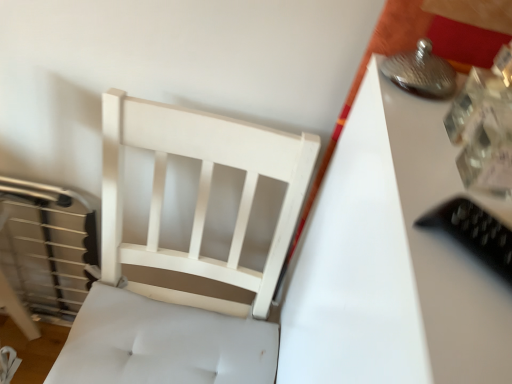
Question: Is white wood chair at left thinner than black plastic remote at right?

Choices:
 (A) yes
 (B) no

Answer: (B)

Question: Is white wood chair at left with black plastic remote at right?

Choices:
 (A) no
 (B) yes

Answer: (A)

Question: Is white wood chair at left positioned beyond the bounds of black plastic remote at right?

Choices:
 (A) no
 (B) yes

Answer: (B)

Question: Can you confirm if white wood chair at left is wider than black plastic remote at right?

Choices:
 (A) no
 (B) yes

Answer: (B)

Question: Considering the relative positions of white wood chair at left and black plastic remote at right in the image provided, is white wood chair at left to the right of black plastic remote at right from the viewer's perspective?

Choices:
 (A) yes
 (B) no

Answer: (B)

Question: From the image's perspective, is black plastic remote at right located above or below white glossy table at upper right?

Choices:
 (A) above
 (B) below

Answer: (A)

Question: Is black plastic remote at right in front of or behind white glossy table at upper right in the image?

Choices:
 (A) behind
 (B) front

Answer: (B)

Question: Would you say black plastic remote at right is to the left or to the right of white glossy table at upper right in the picture?

Choices:
 (A) right
 (B) left

Answer: (B)

Question: Is black plastic remote at right inside or outside of white glossy table at upper right?

Choices:
 (A) inside
 (B) outside

Answer: (B)

Question: Considering the positions of black plastic remote at right and white wood chair at left in the image, is black plastic remote at right wider or thinner than white wood chair at left?

Choices:
 (A) thin
 (B) wide

Answer: (A)

Question: From the image's perspective, relative to white wood chair at left, is black plastic remote at right above or below?

Choices:
 (A) below
 (B) above

Answer: (B)

Question: Considering the positions of point (477, 208) and point (180, 370), is point (477, 208) closer or farther from the camera than point (180, 370)?

Choices:
 (A) closer
 (B) farther

Answer: (A)

Question: In terms of size, does black plastic remote at right appear bigger or smaller than white wood chair at left?

Choices:
 (A) small
 (B) big

Answer: (A)

Question: From a real-world perspective, relative to white glossy table at upper right, is white wood chair at left vertically above or below?

Choices:
 (A) above
 (B) below

Answer: (B)

Question: Based on their positions, is white wood chair at left located to the left or right of white glossy table at upper right?

Choices:
 (A) left
 (B) right

Answer: (A)